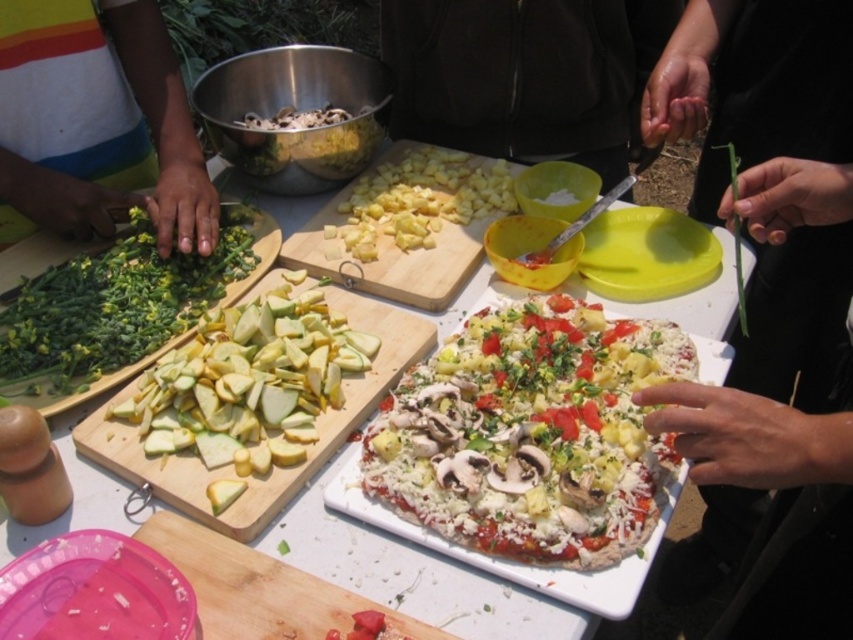
Question: Which object is farther from the camera taking this photo?

Choices:
 (A) wooden cutting board at lower center
 (B) white rectangular board at center

Answer: (B)

Question: Can you confirm if white cheese pizza at center is bigger than pink plastic plate at lower left?

Choices:
 (A) yes
 (B) no

Answer: (A)

Question: Which object is positioned farthest from the green leafy vegetables at left?

Choices:
 (A) yellow diced pineapple at center
 (B) green leafy vegetable at upper right
 (C) green wooden cutting board at center-left

Answer: (B)

Question: Can you confirm if green leafy vegetable at upper right is positioned to the right of white rectangular board at center?

Choices:
 (A) no
 (B) yes

Answer: (B)

Question: Is yellow diced pineapple at center thinner than yellow plastic plate at center?

Choices:
 (A) yes
 (B) no

Answer: (B)

Question: Which of the following is the farthest from the observer?

Choices:
 (A) (196, 504)
 (B) (775, 481)

Answer: (A)